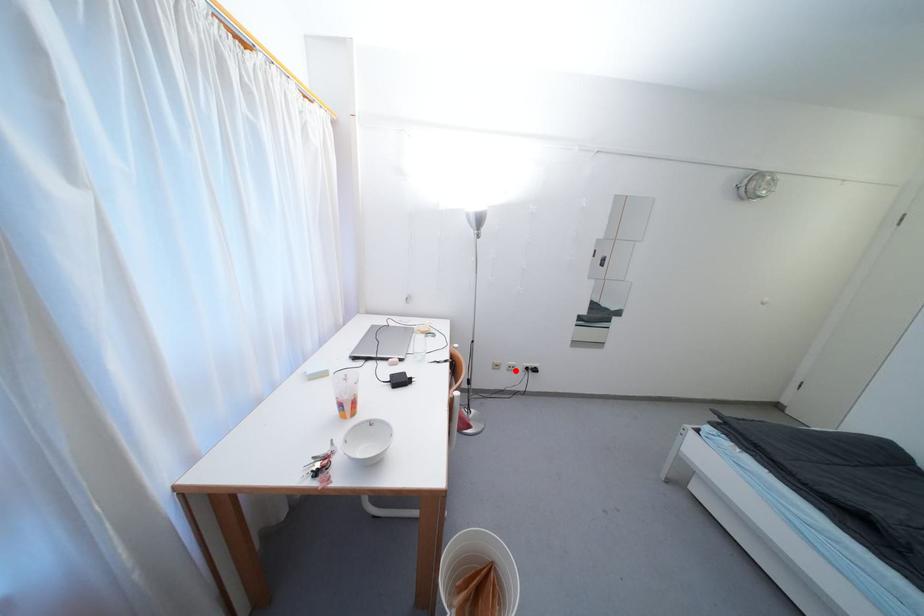
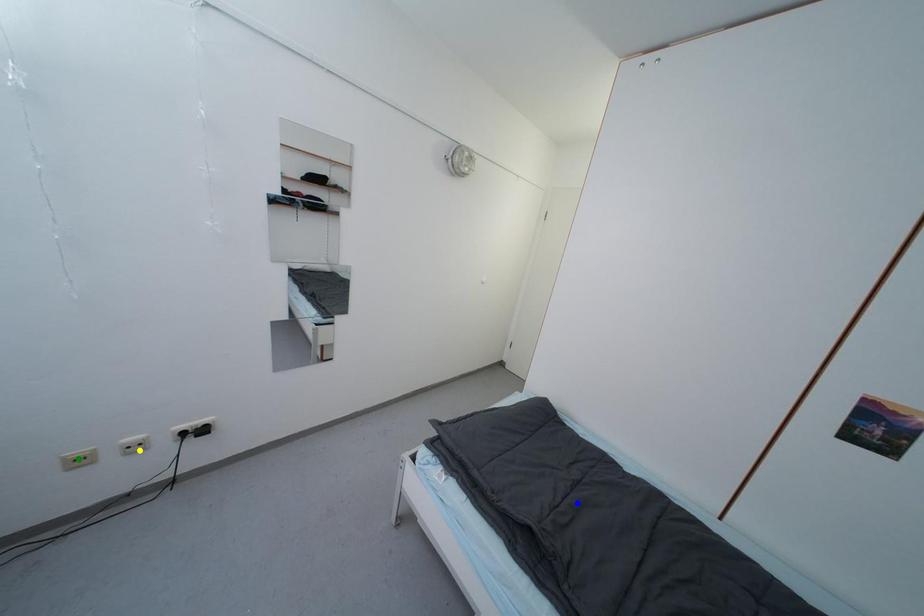
Question: I am providing you with two images of the same scene from different viewpoints. A red point is marked on the first image. You are given multiple points on the second image. Can you choose the point in image 2 that corresponds to the point in image 1?

Choices:
 (A) green point
 (B) yellow point
 (C) blue point

Answer: (B)